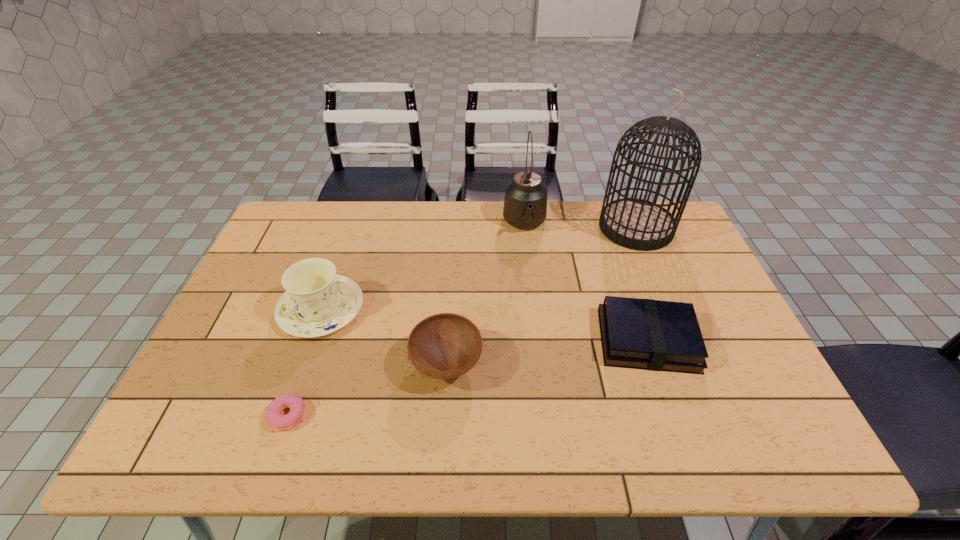
Find the location of a particular element. book present at the right edge is located at coordinates coord(649,334).

Identify the location of object at the far right corner. (638, 224).

This screenshot has height=540, width=960. Find the location of `free space at the far edge of the desktop`. free space at the far edge of the desktop is located at coordinates (483, 215).

Where is `free space at the near edge`? free space at the near edge is located at coordinates (250, 433).

In the image, there is a desktop. Where is `blank space at the left edge`? This screenshot has width=960, height=540. blank space at the left edge is located at coordinates (237, 373).

Where is `vacant area at the right edge`? The height and width of the screenshot is (540, 960). vacant area at the right edge is located at coordinates (757, 404).

This screenshot has width=960, height=540. I want to click on free space at the far left corner, so 329,205.

Identify the location of blank space at the near left corner. Image resolution: width=960 pixels, height=540 pixels. (176, 432).

The height and width of the screenshot is (540, 960). I want to click on vacant space at the far right corner of the desktop, so click(680, 231).

Locate an element on the screen. Image resolution: width=960 pixels, height=540 pixels. unoccupied area between the chinaware and the third object from left to right is located at coordinates (384, 337).